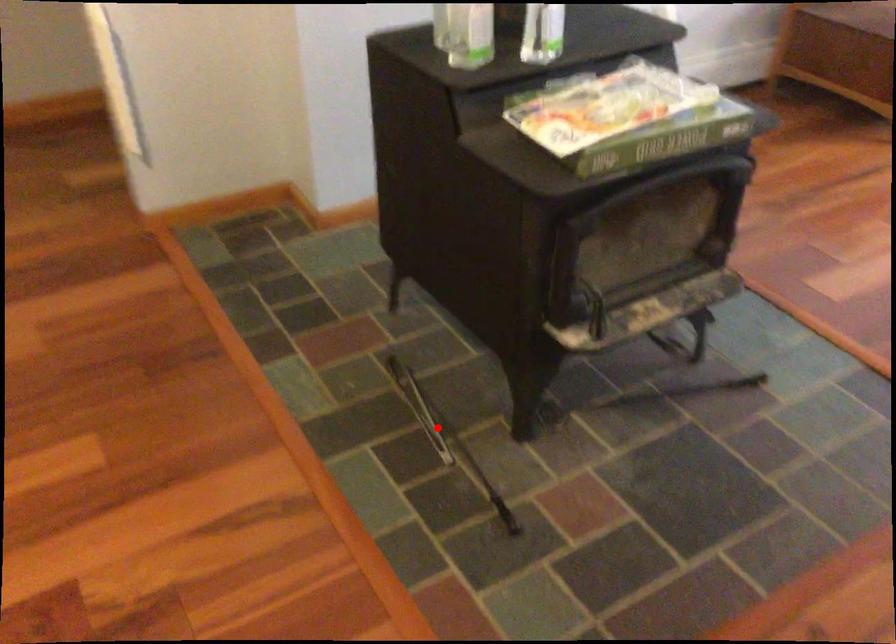
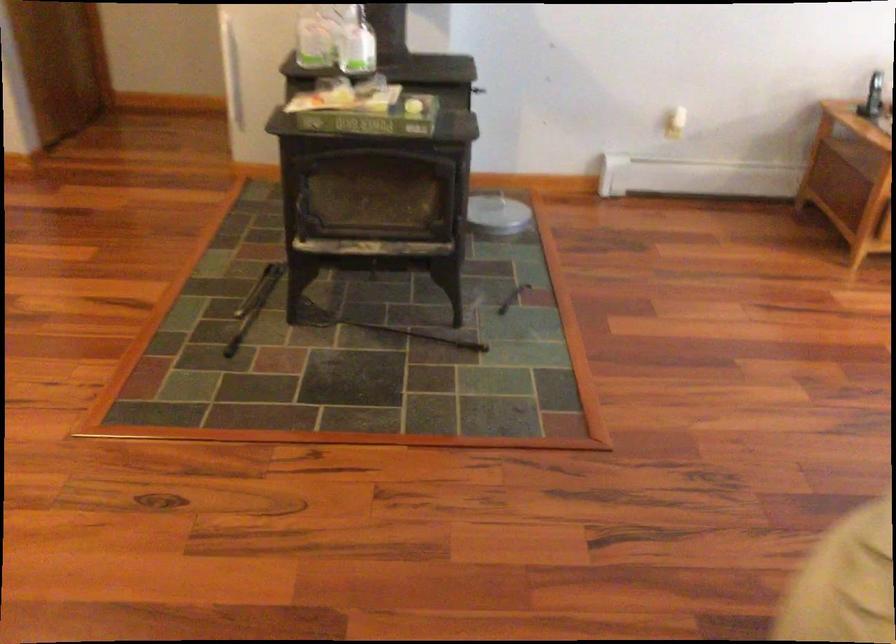
Question: I am providing you with two images of the same scene from different viewpoints. Image1 has a red point marked. In image2, the corresponding 3D location appears at what relative position? Reply with the corresponding letter.

Choices:
 (A) Closer
 (B) Farther

Answer: (B)